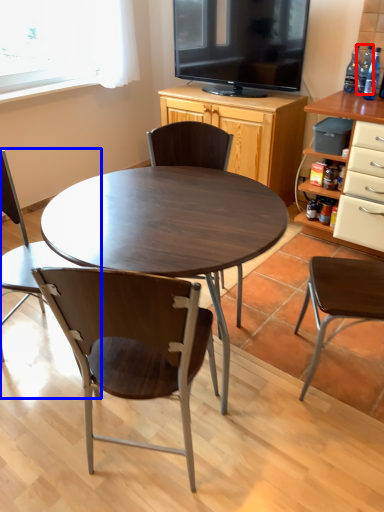
Question: Which object is closer to the camera taking this photo, bottle (highlighted by a red box) or chair (highlighted by a blue box)?

Choices:
 (A) bottle
 (B) chair

Answer: (B)